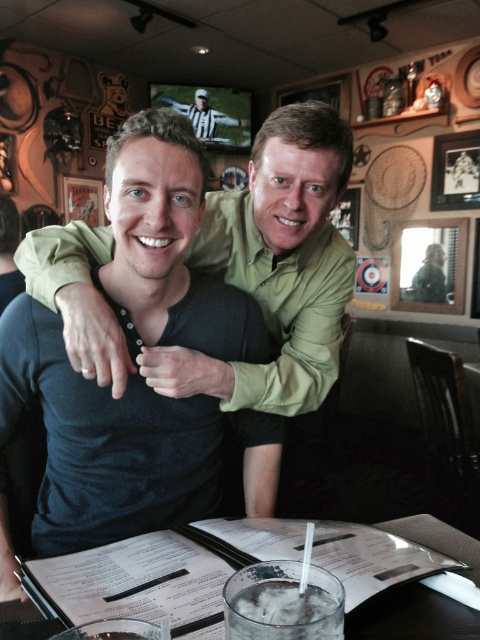
Question: Based on their relative distances, which object is nearer to the green matte shirt at center?

Choices:
 (A) clear plastic cup at center
 (B) clear glass at center

Answer: (A)

Question: Based on their relative distances, which object is nearer to the clear glass ice at table center?

Choices:
 (A) clear plastic cup at center
 (B) green matte shirt at center
 (C) clear glass at center

Answer: (C)

Question: Is green matte shirt at center closer to camera compared to clear plastic cup at center?

Choices:
 (A) no
 (B) yes

Answer: (A)

Question: Is green matte shirt at center to the left of clear plastic cup at center from the viewer's perspective?

Choices:
 (A) yes
 (B) no

Answer: (A)

Question: Can you confirm if green matte shirt at center is bigger than clear plastic cup at center?

Choices:
 (A) yes
 (B) no

Answer: (A)

Question: Which of these objects is positioned closest to the clear glass at center?

Choices:
 (A) green matte shirt at center
 (B) clear plastic cup at center

Answer: (B)